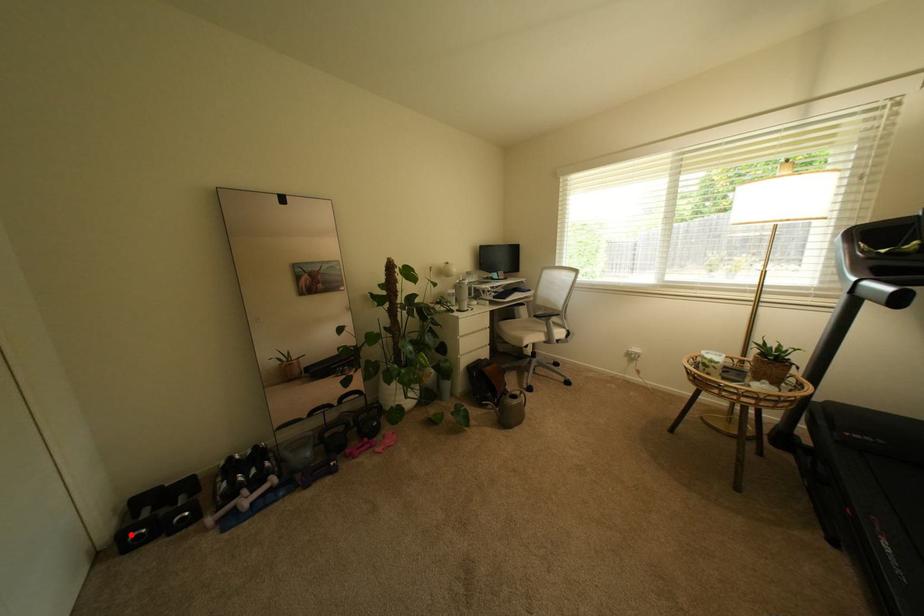
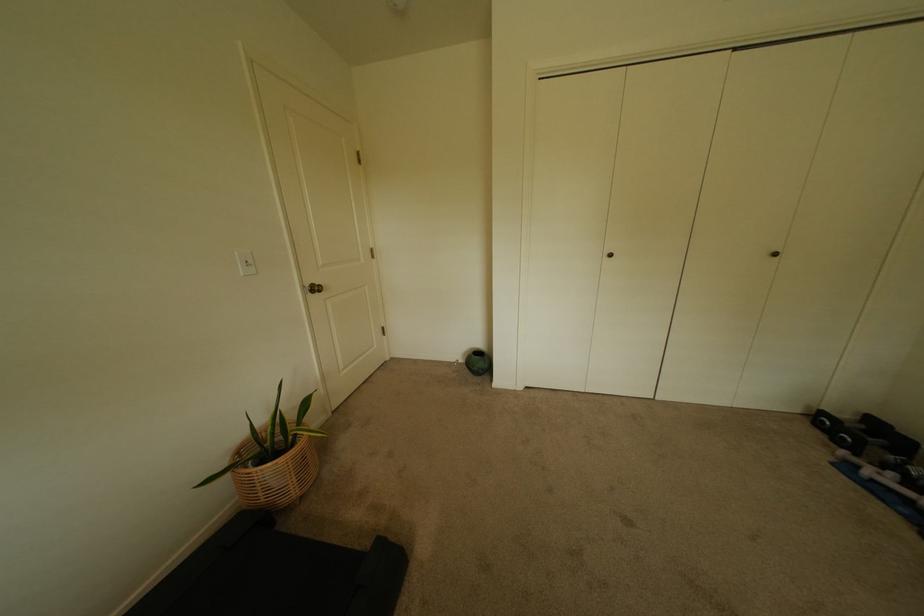
Locate, in the second image, the point that corresponds to the highlighted location in the first image.

(831, 415)